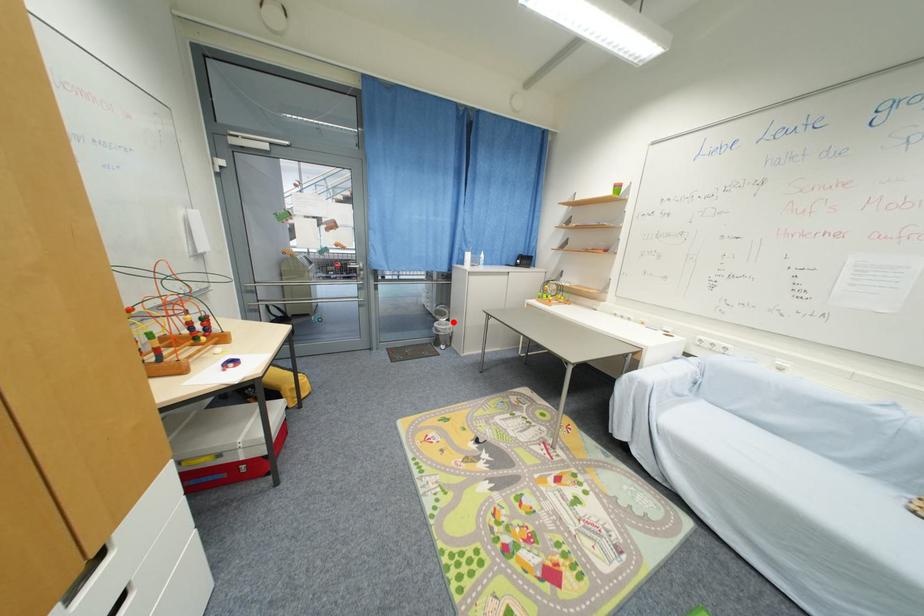
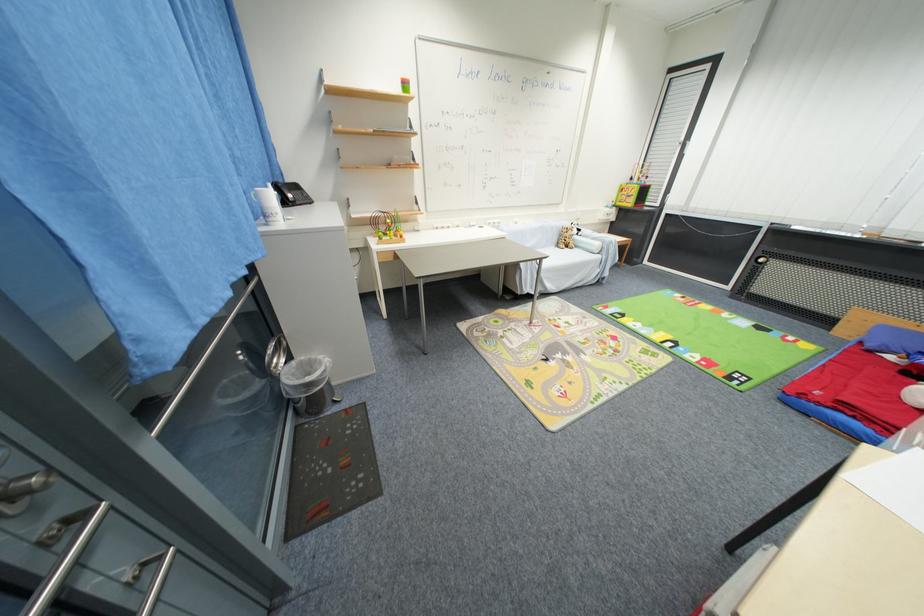
Where in the second image is the point corresponding to the highlighted location from the first image?

(295, 360)